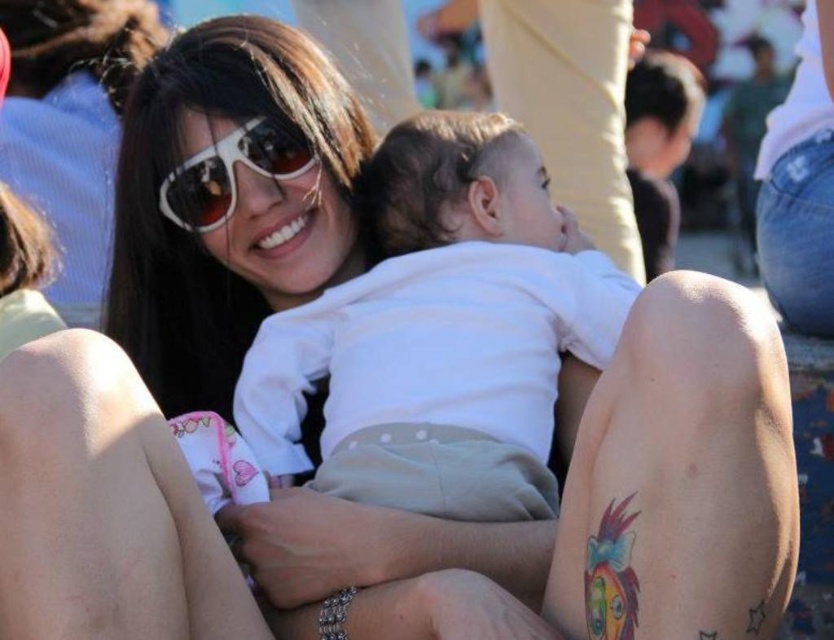
Question: Which of the following is the closest to the observer?

Choices:
 (A) (618, 272)
 (B) (227, 179)

Answer: (B)

Question: Where is white soft fabric baby at center located in relation to white glossy sunglasses at upper center in the image?

Choices:
 (A) above
 (B) below

Answer: (B)

Question: Which point is closer to the camera taking this photo?

Choices:
 (A) [490, 413]
 (B) [174, 182]

Answer: (A)

Question: Is white soft fabric baby at center bigger than white glossy sunglasses at upper center?

Choices:
 (A) yes
 (B) no

Answer: (A)

Question: Considering the relative positions of white soft fabric baby at center and white glossy sunglasses at upper center in the image provided, where is white soft fabric baby at center located with respect to white glossy sunglasses at upper center?

Choices:
 (A) left
 (B) right

Answer: (B)